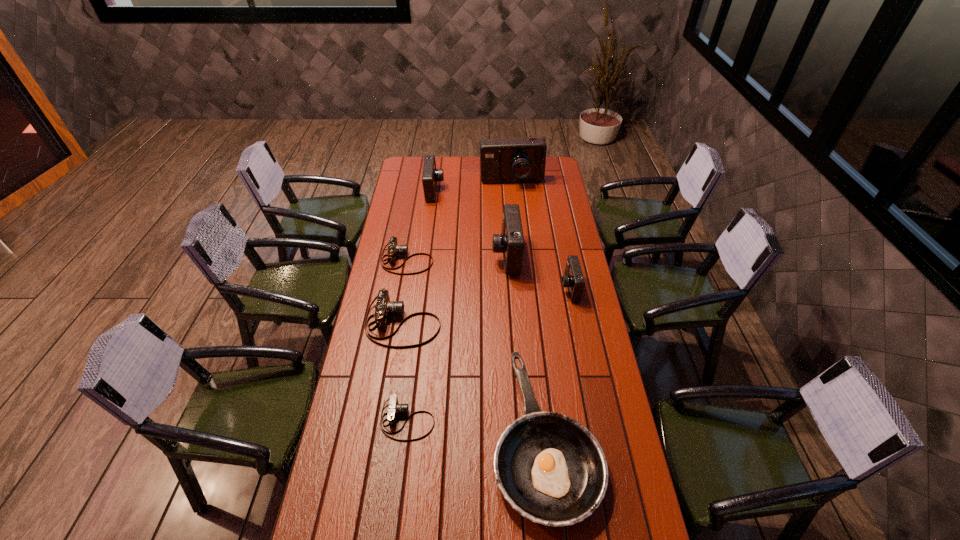
Select which object appears as the closest to the frying pan. Please provide its 2D coordinates. Your answer should be formatted as a tuple, i.e. [(x, y)], where the tuple contains the x and y coordinates of a point satisfying the conditions above.

[(394, 408)]

Identify the location of camera that is the third closest to the second smallest blue camera. (510, 242).

Identify which camera is located as the sixth nearest to the sixth shortest camera. Please provide its 2D coordinates. Your answer should be formatted as a tuple, i.e. [(x, y)], where the tuple contains the x and y coordinates of a point satisfying the conditions above.

[(394, 408)]

Select which blue camera appears as the second closest to the fifth shortest object. Please provide its 2D coordinates. Your answer should be formatted as a tuple, i.e. [(x, y)], where the tuple contains the x and y coordinates of a point satisfying the conditions above.

[(522, 159)]

Locate an element on the screen. blue camera object that ranks as the closest to the tallest object is located at coordinates (430, 176).

Image resolution: width=960 pixels, height=540 pixels. Identify the location of the closest brown camera to the fourth tallest camera. [384, 308].

Find the location of a particular element. the closest brown camera to the shortest camera is located at coordinates (384, 308).

Locate an element on the screen. This screenshot has width=960, height=540. free space that satisfies the following two spatial constraints: 1. on the front-facing side of the tallest camera; 2. on the front-facing side of the sixth tallest camera is located at coordinates (519, 260).

Where is `vacant region that satisfies the following two spatial constraints: 1. on the front-facing side of the seventh shortest object; 2. on the back side of the red frying pan`? The image size is (960, 540). vacant region that satisfies the following two spatial constraints: 1. on the front-facing side of the seventh shortest object; 2. on the back side of the red frying pan is located at coordinates (517, 436).

The width and height of the screenshot is (960, 540). Identify the location of free space that satisfies the following two spatial constraints: 1. on the front-facing side of the red frying pan; 2. on the right side of the second farthest brown camera. (385, 436).